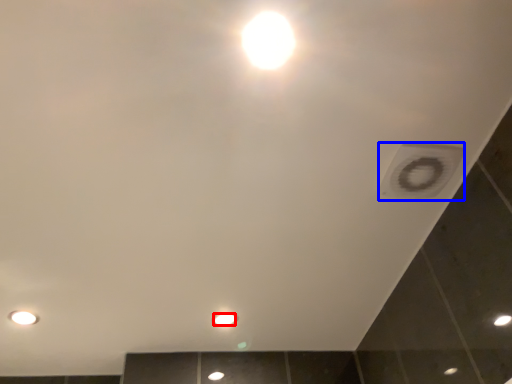
Question: Which object appears farthest to the camera in this image, light bulb (highlighted by a red box) or hole (highlighted by a blue box)?

Choices:
 (A) light bulb
 (B) hole

Answer: (A)